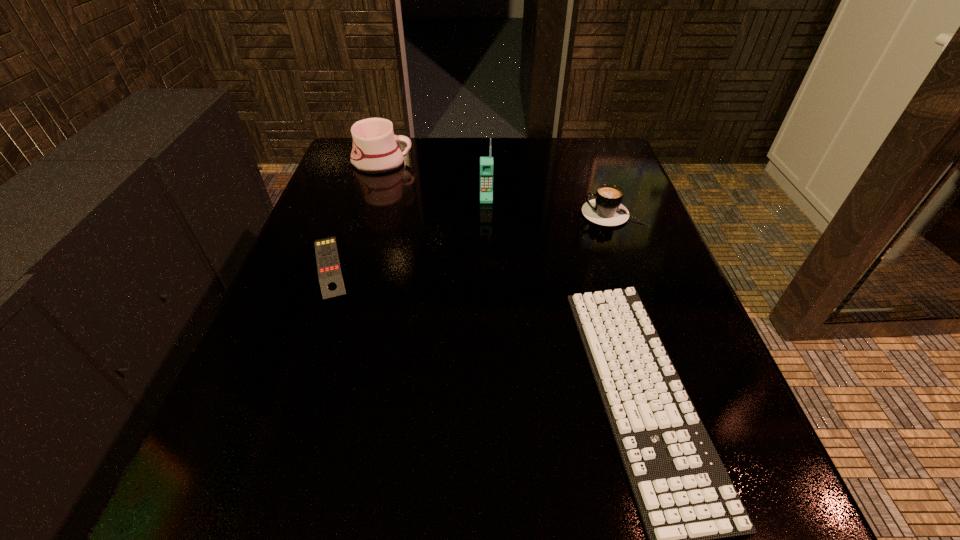
Locate an element on the screen. cellular telephone is located at coordinates (486, 163).

Locate an element on the screen. the tallest object is located at coordinates (486, 163).

You are a GUI agent. You are given a task and a screenshot of the screen. Output one action in this format:
    pyautogui.click(x=<x>, y=<y>)
    Task: Click on the mug
    Image resolution: width=960 pixels, height=540 pixels.
    Given the screenshot: What is the action you would take?
    pyautogui.click(x=375, y=150)

The image size is (960, 540). I want to click on the farthest object, so click(375, 150).

What are the coordinates of `cappuccino` in the screenshot? It's located at (606, 209).

At what (x,y) coordinates should I click in order to perform the action: click on remote control. Please return your answer as a coordinate pair (x, y). The height and width of the screenshot is (540, 960). Looking at the image, I should click on (330, 276).

At what (x,y) coordinates should I click in order to perform the action: click on free space located on the keypad of the tallest object. Please return your answer as a coordinate pair (x, y). The image size is (960, 540). Looking at the image, I should click on (487, 249).

Identify the location of free space located 0.340m on the side with the handle of the mug. The image size is (960, 540). (543, 163).

Locate an element on the screen. The height and width of the screenshot is (540, 960). free spot located 0.370m with the handle on the side of the cappuccino is located at coordinates (416, 214).

Identify the location of free space located 0.240m with the handle on the side of the cappuccino. This screenshot has width=960, height=540. (474, 214).